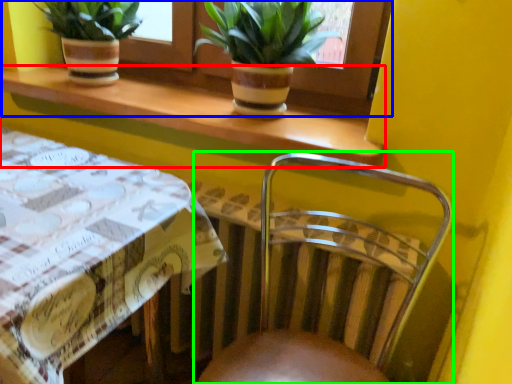
Question: Considering the real-world distances, which object is farthest from window sill (highlighted by a red box)? window frame (highlighted by a blue box) or chair (highlighted by a green box)?

Choices:
 (A) window frame
 (B) chair

Answer: (B)